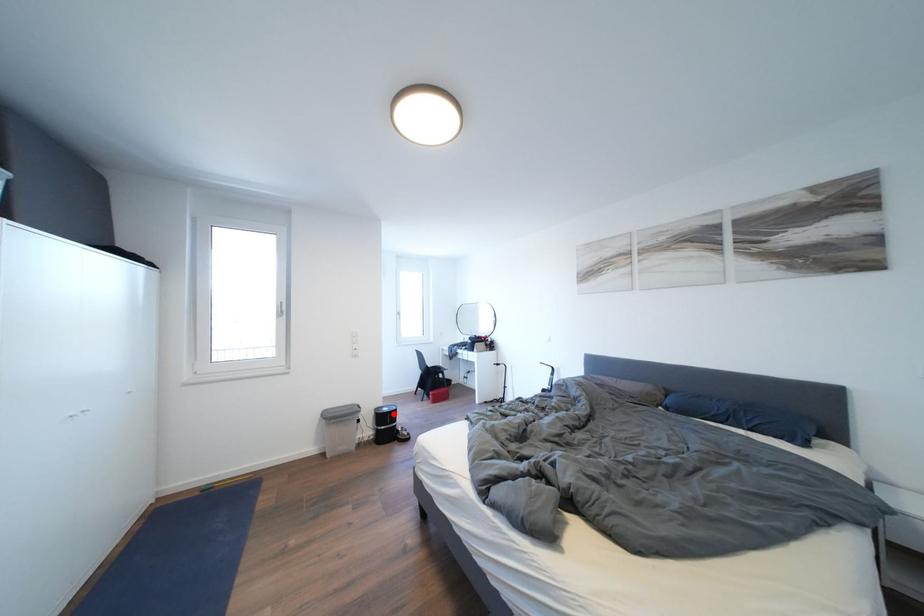
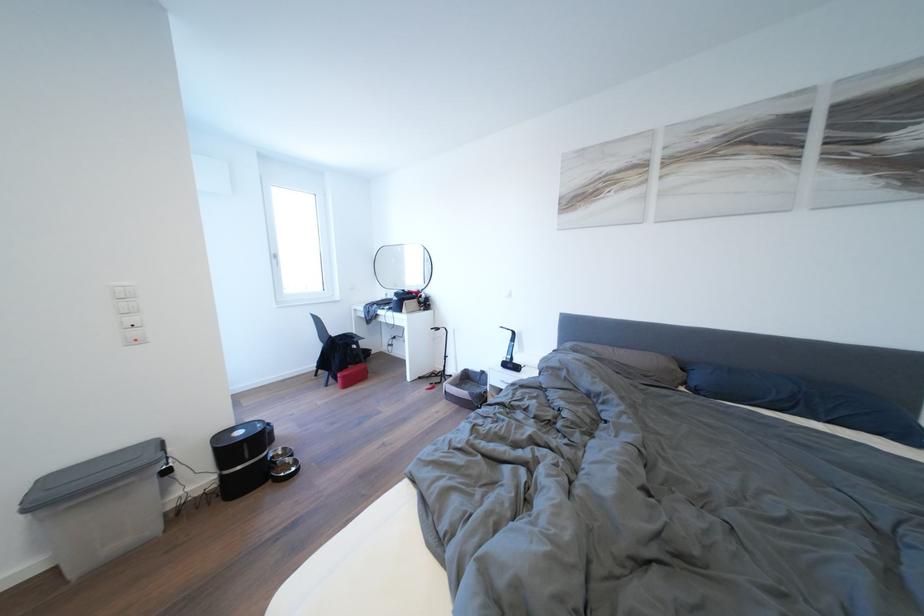
Question: I am providing you with two images of the same scene from different viewpoints. Given a red point in image1, look at the same physical point in image2. Is it:

Choices:
 (A) Closer to the viewpoint
 (B) Farther from the viewpoint

Answer: (B)